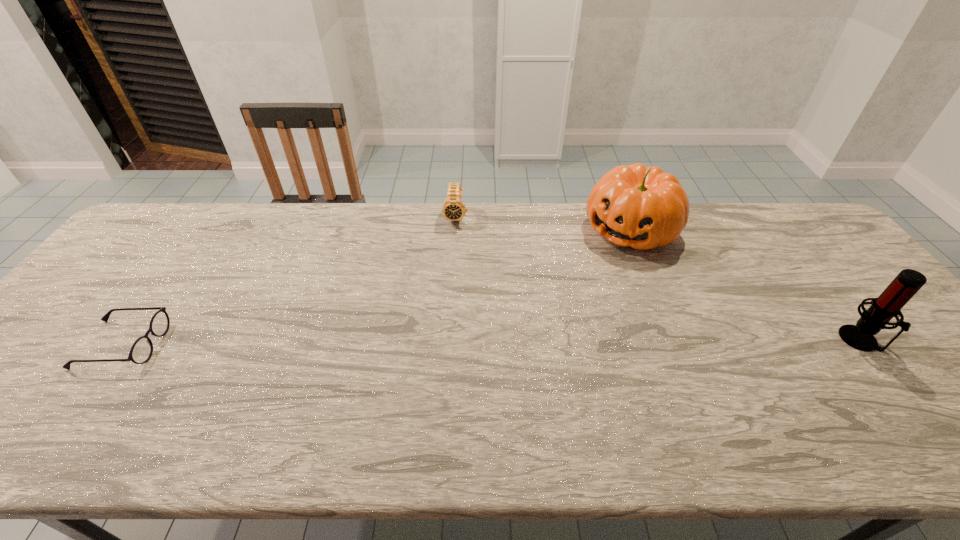
Where is `free space on the desktop that is between the leftmost object and the rightmost object and is positioned on the carved face of the pumpkin`? free space on the desktop that is between the leftmost object and the rightmost object and is positioned on the carved face of the pumpkin is located at coordinates (541, 342).

Locate an element on the screen. This screenshot has width=960, height=540. vacant space on the desktop that is between the spectacles and the microphone and is positioned on the face of the watch is located at coordinates (444, 343).